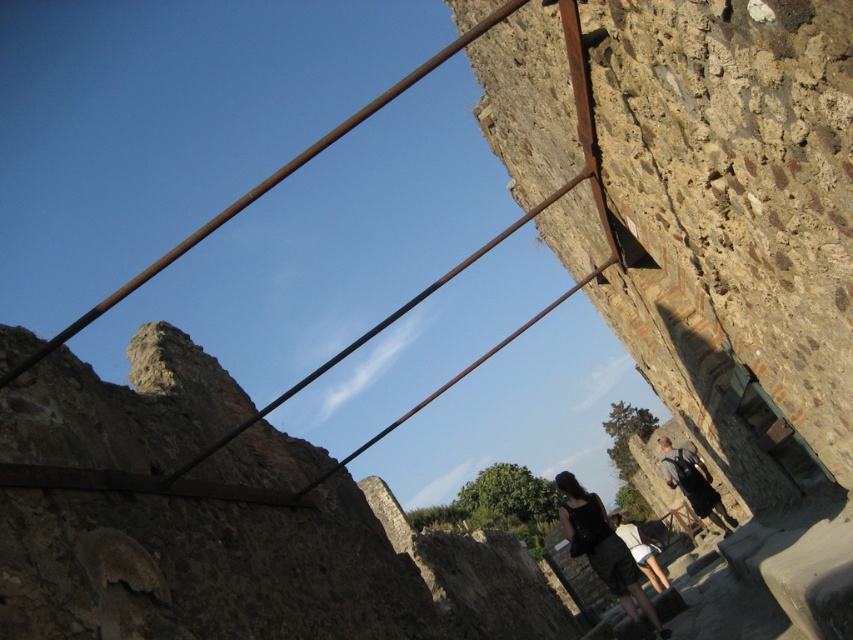
Question: Can you confirm if rusty metal rail at upper center is bigger than dark gray backpack at center?

Choices:
 (A) yes
 (B) no

Answer: (A)

Question: Which of the following is the closest to the observer?

Choices:
 (A) (608, 518)
 (B) (706, 504)
 (C) (621, 602)
 (D) (483, 358)

Answer: (D)

Question: Among these objects, which one is nearest to the camera?

Choices:
 (A) dark gray fabric dress at center
 (B) dark gray backpack at center

Answer: (A)

Question: Can you confirm if rusty metal rail at upper center is positioned below dark gray backpack at center?

Choices:
 (A) yes
 (B) no

Answer: (B)

Question: Does dark gray backpack at center have a larger size compared to white cotton shirt at lower center?

Choices:
 (A) yes
 (B) no

Answer: (B)

Question: Which of the following is the farthest from the observer?

Choices:
 (A) dark gray backpack at center
 (B) white cotton shirt at lower center
 (C) dark gray fabric dress at center
 (D) rusty metal rail at upper center

Answer: (A)